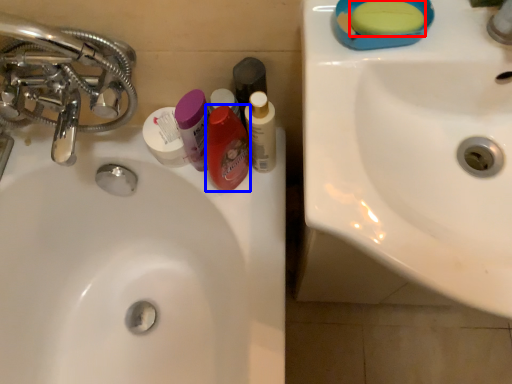
Question: Which object is further to the camera taking this photo, soap (highlighted by a red box) or mouthwash (highlighted by a blue box)?

Choices:
 (A) soap
 (B) mouthwash

Answer: (B)